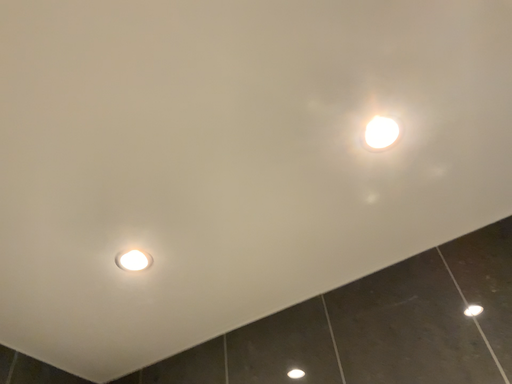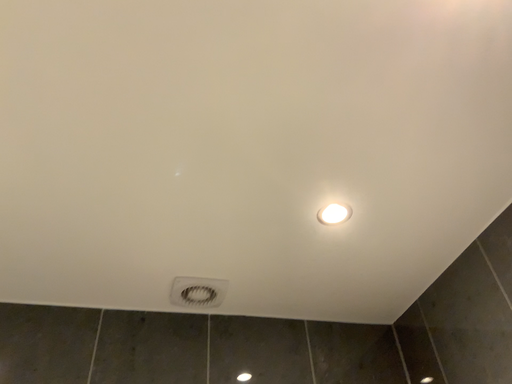
Question: How did the camera likely rotate when shooting the video?

Choices:
 (A) rotated left
 (B) rotated right

Answer: (A)